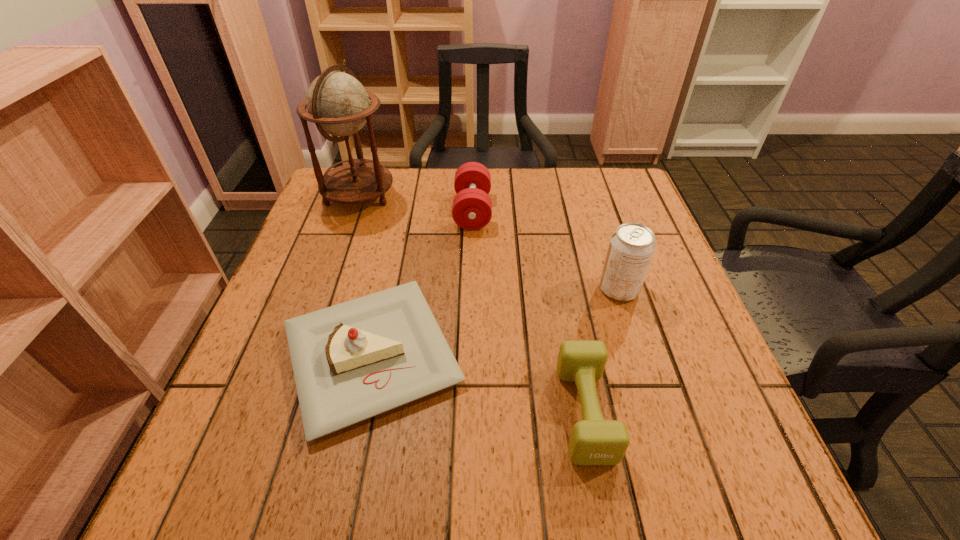
Identify the location of vacant area situated 0.090m on the right of the left dumbbell. This screenshot has width=960, height=540. (526, 211).

You are a GUI agent. You are given a task and a screenshot of the screen. Output one action in this format:
    pyautogui.click(x=<x>, y=<y>)
    Task: Click on the vacant region located on the back of the cake
    Image resolution: width=960 pixels, height=540 pixels.
    Given the screenshot: What is the action you would take?
    pyautogui.click(x=400, y=222)

The image size is (960, 540). Identify the location of vacant space located 0.050m on the front of the right dumbbell. point(602,502).

Identify the location of globe located in the far edge section of the desktop. This screenshot has width=960, height=540. (338, 104).

Where is `dumbbell positioned at the far edge`? The width and height of the screenshot is (960, 540). dumbbell positioned at the far edge is located at coordinates (472, 209).

This screenshot has width=960, height=540. I want to click on cake that is at the near edge, so click(352, 361).

Locate an element on the screen. Image resolution: width=960 pixels, height=540 pixels. dumbbell that is at the near edge is located at coordinates (594, 441).

Find the location of a particular element. The height and width of the screenshot is (540, 960). globe that is positioned at the left edge is located at coordinates (338, 104).

Where is `cake that is at the left edge`? cake that is at the left edge is located at coordinates (352, 361).

The height and width of the screenshot is (540, 960). I want to click on object at the right edge, so (631, 248).